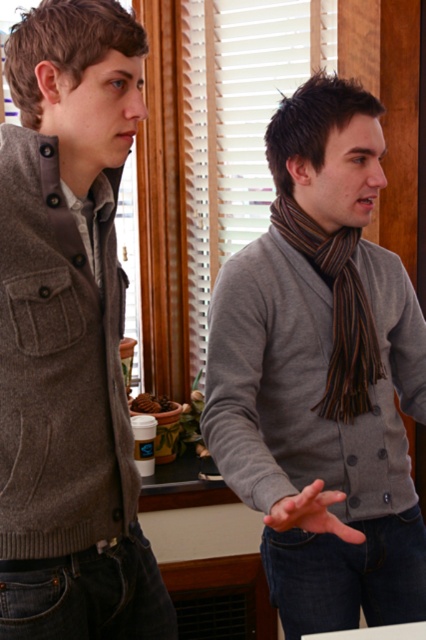
Question: Can you confirm if gray wool sweater at center is wider than gray wool cardigan at left?

Choices:
 (A) yes
 (B) no

Answer: (A)

Question: Which object is farther from the camera taking this photo?

Choices:
 (A) striped wool scarf at center
 (B) gray wool sweater at center
 (C) gray wool cardigan at left

Answer: (A)

Question: Does gray wool sweater at center have a lesser width compared to striped wool scarf at center?

Choices:
 (A) no
 (B) yes

Answer: (A)

Question: Which point appears closest to the camera in this image?

Choices:
 (A) (281, 614)
 (B) (350, 349)
 (C) (94, 428)

Answer: (C)

Question: Which point is closer to the camera?

Choices:
 (A) (348, 305)
 (B) (66, 234)

Answer: (B)

Question: Does gray wool sweater at center appear on the left side of striped wool scarf at center?

Choices:
 (A) yes
 (B) no

Answer: (A)